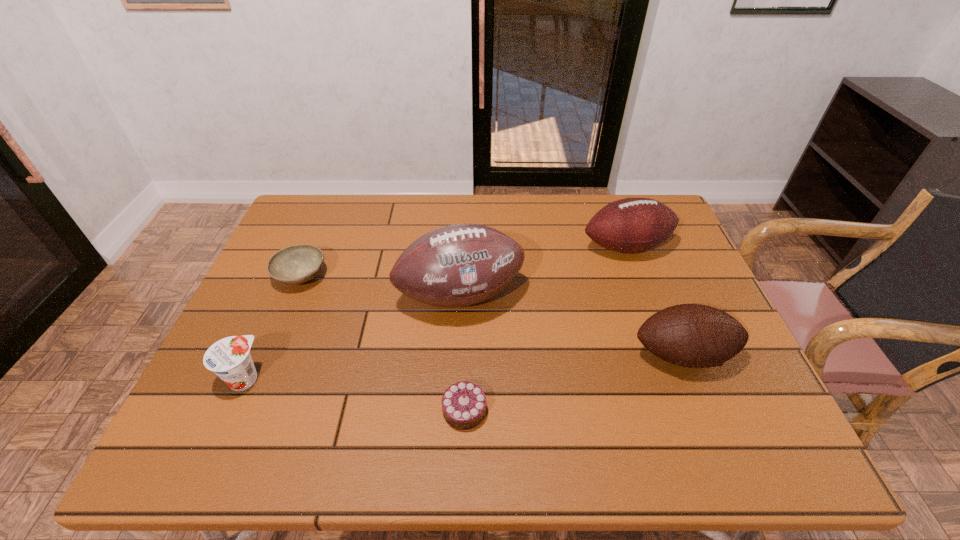
Find the location of a particular element. This screenshot has height=540, width=960. free space between the yogurt and the farthest football is located at coordinates (435, 313).

Locate which object is the closest to the yogurt. Please provide its 2D coordinates. Your answer should be formatted as a tuple, i.e. [(x, y)], where the tuple contains the x and y coordinates of a point satisfying the conditions above.

[(297, 264)]

Where is `object that stands as the fourth closest to the yogurt`? The width and height of the screenshot is (960, 540). object that stands as the fourth closest to the yogurt is located at coordinates (690, 335).

The width and height of the screenshot is (960, 540). What are the coordinates of `the closest football to the chocolate cake` in the screenshot? It's located at click(x=458, y=265).

This screenshot has width=960, height=540. I want to click on football that stands as the second closest to the bowl, so click(631, 225).

I want to click on vacant region that satisfies the following two spatial constraints: 1. on the front side of the second nearest football; 2. on the left side of the chocolate cake, so click(455, 410).